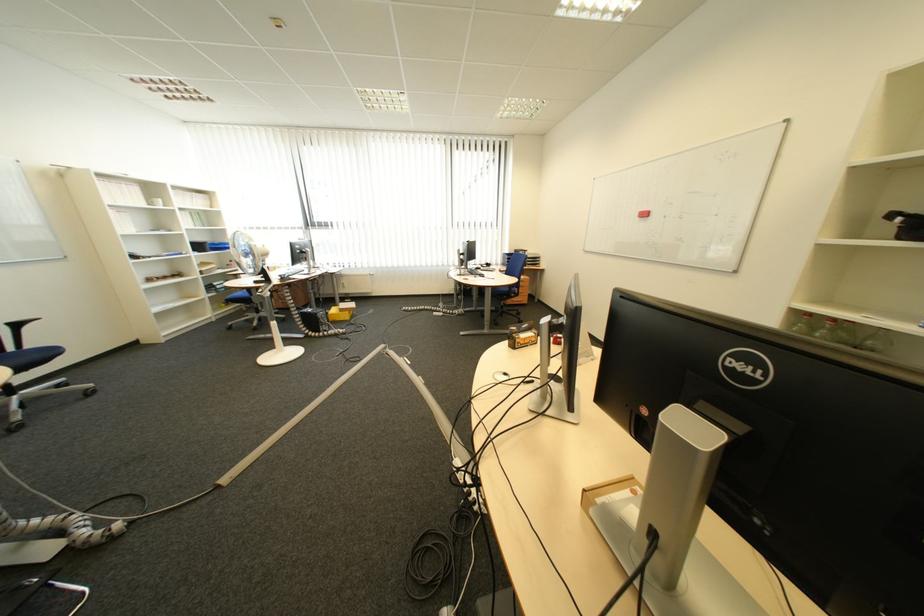
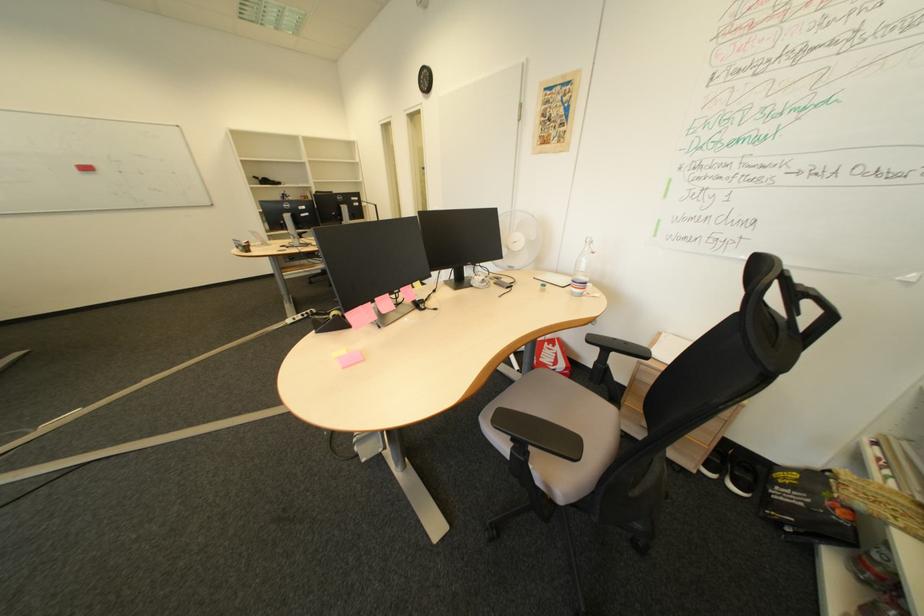
Find the pixel in the second image that matches pixel 677 217 in the first image.

(135, 174)